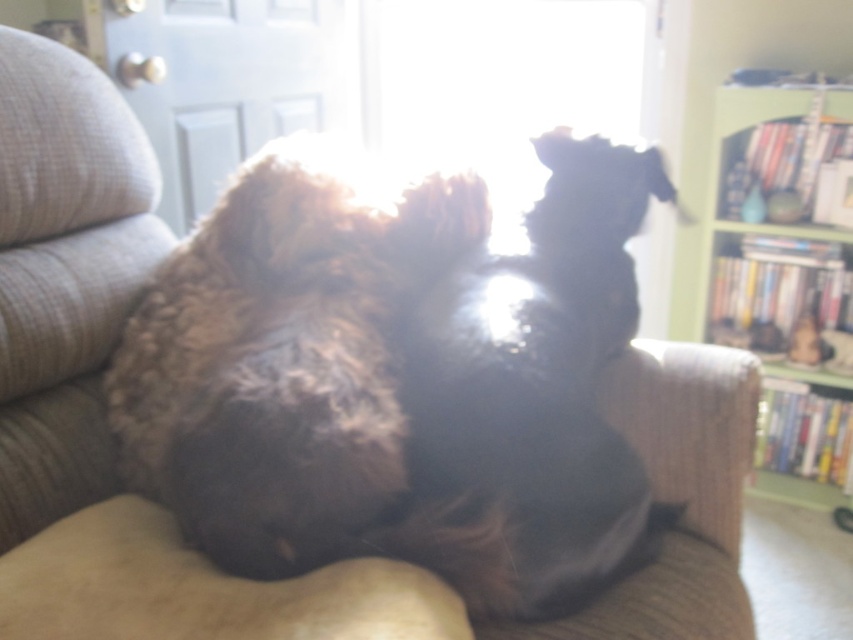
You are a dog groomer who needs to choose the right size of grooming table for two dogs. The fuzzy brown dog at center and the shiny black dog at center are both going to be groomed. Based on their sizes, which dog requires a larger grooming table?

The fuzzy brown dog at center requires a larger grooming table because its width is greater than that of the shiny black dog at center.

You are a delivery person standing at the point marked by the coordinate point at (345, 401). You need to place a package between the two dogs lying on the couch. The package requires 3 feet of space. Can you fit it between them?

The distance between the two dogs is 3.41 feet, which is more than the required 3 feet, so yes, the package can be placed between them.

You are taking a photo of two dogs lying on a couch. You want to focus on the point closer to the camera. Which point should you choose between point [546,257] and point [772,186]?

Point [546,257] is closer to the camera than point [772,186], so you should choose point [546,257] to focus on.